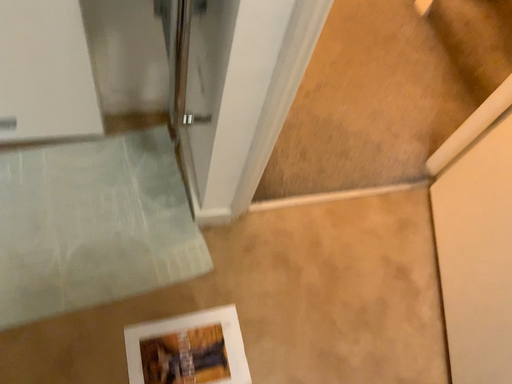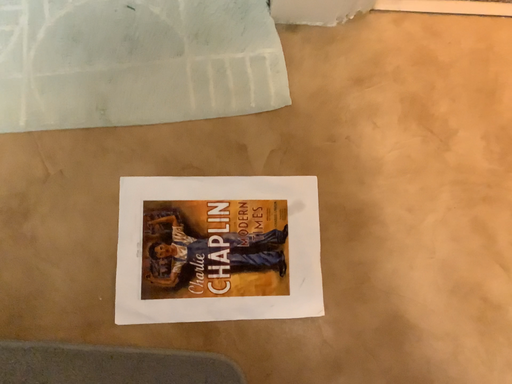
Question: How did the camera likely rotate when shooting the video?

Choices:
 (A) rotated downward
 (B) rotated upward

Answer: (A)